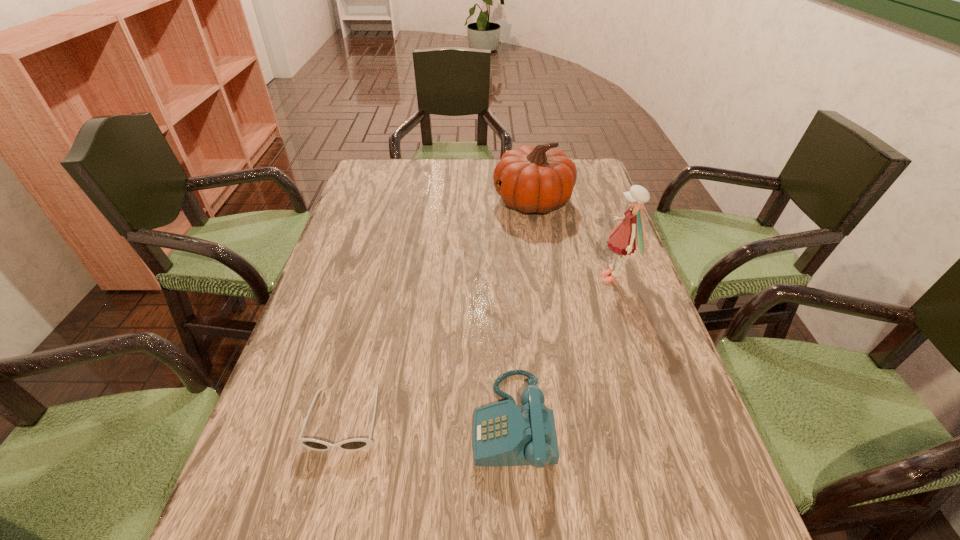
Locate an element on the screen. This screenshot has width=960, height=540. vacant space located on the face of the pumpkin is located at coordinates (408, 201).

Identify the location of vacant space situated on the face of the pumpkin. Image resolution: width=960 pixels, height=540 pixels. (440, 201).

Where is `blank space located on the face of the pumpkin`? The image size is (960, 540). blank space located on the face of the pumpkin is located at coordinates 458,201.

At what (x,y) coordinates should I click in order to perform the action: click on vacant space situated 0.250m on the dial of the second shortest object. Please return your answer as a coordinate pair (x, y). Looking at the image, I should click on (341, 421).

Find the location of a particular element. The height and width of the screenshot is (540, 960). blank space located 0.200m on the dial of the second shortest object is located at coordinates (368, 421).

Locate an element on the screen. vacant space located 0.360m on the dial of the second shortest object is located at coordinates (282, 421).

Identify the location of vacant area situated with the lenses of the leftmost object facing outward. (320, 521).

I want to click on object present at the far edge, so (x=538, y=179).

Identify the location of object that is at the left edge. This screenshot has width=960, height=540. (356, 444).

The image size is (960, 540). What are the coordinates of `doll positioned at the right edge` in the screenshot? It's located at point(630,233).